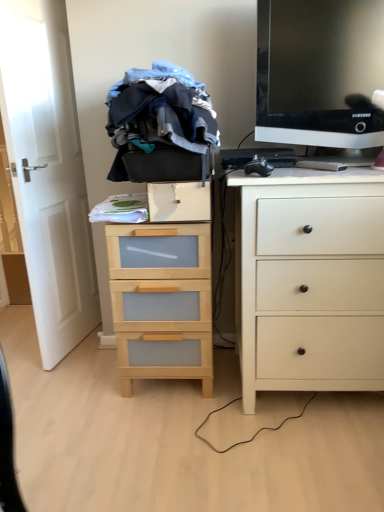
The height and width of the screenshot is (512, 384). What are the coordinates of `wooden drawer at center` in the screenshot? It's located at (179, 202).

Measure the distance between blue cotton clothes at center and camera.

blue cotton clothes at center and camera are 4.44 feet apart from each other.

Where is `blue cotton clothes at center`? The height and width of the screenshot is (512, 384). blue cotton clothes at center is located at coordinates (160, 115).

Where is `black plastic keyboard at center`? black plastic keyboard at center is located at coordinates (258, 157).

Is the depth of black glossy monitor at upper right greater than that of wooden drawer at center?

No, black glossy monitor at upper right is closer to the camera.

Considering the positions of objects black glossy monitor at upper right and wooden drawer at center in the image provided, who is more to the right, black glossy monitor at upper right or wooden drawer at center?

black glossy monitor at upper right.

Is black glossy monitor at upper right oriented away from wooden drawer at center?

No.

How much distance is there between black glossy monitor at upper right and wooden drawer at center?

black glossy monitor at upper right and wooden drawer at center are 22.32 inches apart from each other.

Identify the location of the chest of drawers that is the 2nd object directly below the black plastic keyboard at center (from a real-world perspective). The width and height of the screenshot is (384, 512). (163, 290).

Is wooden chest of drawers at center, the 1th chest of drawers from the left, surrounded by black plastic keyboard at center?

Actually, wooden chest of drawers at center, the 1th chest of drawers from the left, is outside black plastic keyboard at center.

Is black plastic keyboard at center oriented towards wooden chest of drawers at center, the 1th chest of drawers from the left?

No, black plastic keyboard at center does not turn towards wooden chest of drawers at center, the 1th chest of drawers from the left.

Would you consider black plastic keyboard at center to be distant from wooden chest of drawers at center, marked as the second chest of drawers in a right-to-left arrangement?

No, black plastic keyboard at center is not far away from wooden chest of drawers at center, marked as the second chest of drawers in a right-to-left arrangement.

From the image's perspective, relative to white matte chest of drawers at right, the 1th chest of drawers viewed from the right, is black glossy monitor at upper right above or below?

Based on their image positions, black glossy monitor at upper right is located above white matte chest of drawers at right, the 1th chest of drawers viewed from the right.

Does black glossy monitor at upper right turn towards white matte chest of drawers at right, the 1th chest of drawers viewed from the right?

No, black glossy monitor at upper right is not aimed at white matte chest of drawers at right, the 1th chest of drawers viewed from the right.

How many degrees apart are the facing directions of black glossy monitor at upper right and white matte chest of drawers at right, the 1th chest of drawers viewed from the right?

The angle between the facing direction of black glossy monitor at upper right and the facing direction of white matte chest of drawers at right, the 1th chest of drawers viewed from the right, is 1.1 degrees.

Considering the relative positions of black glossy monitor at upper right and white matte chest of drawers at right, the 1th chest of drawers viewed from the right, in the image provided, is black glossy monitor at upper right in front of white matte chest of drawers at right, the 1th chest of drawers viewed from the right,?

No, it is behind white matte chest of drawers at right, the 1th chest of drawers viewed from the right.

Find the location of a particular element. drawer above the white matte chest of drawers at right, which is counted as the 2th chest of drawers, starting from the left (from a real-world perspective) is located at coordinates (179, 202).

Who is shorter, white matte chest of drawers at right, the 1th chest of drawers viewed from the right, or wooden drawer at center?

With less height is wooden drawer at center.

From a real-world perspective, between white matte chest of drawers at right, which is counted as the 2th chest of drawers, starting from the left, and wooden drawer at center, who is vertically higher?

From a 3D spatial view, wooden drawer at center is above.

Is white matte chest of drawers at right, which is counted as the 2th chest of drawers, starting from the left, looking in the opposite direction of wooden drawer at center?

white matte chest of drawers at right, which is counted as the 2th chest of drawers, starting from the left, does not have its back to wooden drawer at center.

Is black glossy monitor at upper right behind wooden chest of drawers at center, marked as the second chest of drawers in a right-to-left arrangement?

No, it is not.

Considering the sizes of objects black glossy monitor at upper right and wooden chest of drawers at center, the 1th chest of drawers from the left, in the image provided, who is wider, black glossy monitor at upper right or wooden chest of drawers at center, the 1th chest of drawers from the left,?

wooden chest of drawers at center, the 1th chest of drawers from the left.

I want to click on television that is on the right side of wooden chest of drawers at center, marked as the second chest of drawers in a right-to-left arrangement, so click(319, 72).

Considering the relative sizes of black glossy monitor at upper right and wooden chest of drawers at center, marked as the second chest of drawers in a right-to-left arrangement, in the image provided, is black glossy monitor at upper right bigger than wooden chest of drawers at center, marked as the second chest of drawers in a right-to-left arrangement,?

Actually, black glossy monitor at upper right might be smaller than wooden chest of drawers at center, marked as the second chest of drawers in a right-to-left arrangement.

Between black plastic keyboard at center and black plastic computer mouse at upper right, which one has more height?

Standing taller between the two is black plastic keyboard at center.

From a real-world perspective, which object rests below the other?

black plastic computer mouse at upper right.

From the picture: From the image's perspective, which one is positioned higher, black plastic keyboard at center or black plastic computer mouse at upper right?

black plastic keyboard at center.

Considering the sizes of black plastic keyboard at center and black plastic computer mouse at upper right in the image, is black plastic keyboard at center bigger or smaller than black plastic computer mouse at upper right?

black plastic keyboard at center is bigger than black plastic computer mouse at upper right.

Considering the sizes of white matte chest of drawers at right, the 1th chest of drawers viewed from the right, and black plastic keyboard at center in the image, is white matte chest of drawers at right, the 1th chest of drawers viewed from the right, bigger or smaller than black plastic keyboard at center?

white matte chest of drawers at right, the 1th chest of drawers viewed from the right, is bigger than black plastic keyboard at center.

Which object is positioned more to the left, white matte chest of drawers at right, which is counted as the 2th chest of drawers, starting from the left, or black plastic keyboard at center?

From the viewer's perspective, black plastic keyboard at center appears more on the left side.

Does white matte chest of drawers at right, which is counted as the 2th chest of drawers, starting from the left, lie behind black plastic keyboard at center?

No, it is not.

Is black plastic keyboard at center at the back of white matte chest of drawers at right, which is counted as the 2th chest of drawers, starting from the left?

No.

Locate an element on the screen. television above the wooden drawer at center (from the image's perspective) is located at coordinates (319, 72).

Find the location of `the 1st chest of drawers in front of the black plastic keyboard at center, starting your count from the anchor`. the 1st chest of drawers in front of the black plastic keyboard at center, starting your count from the anchor is located at coordinates tap(163, 290).

Based on their spatial positions, is white matte chest of drawers at right, the 1th chest of drawers viewed from the right, or wooden drawer at center closer to blue cotton clothes at center?

wooden drawer at center is closer to blue cotton clothes at center.

Which object lies further to the anchor point wooden drawer at center, black plastic computer mouse at upper right or blue cotton clothes at center?

Among the two, black plastic computer mouse at upper right is located further to wooden drawer at center.

When comparing their distances from black glossy monitor at upper right, does wooden drawer at center or wooden chest of drawers at center, the 1th chest of drawers from the left, seem further?

The object further to black glossy monitor at upper right is wooden chest of drawers at center, the 1th chest of drawers from the left.

Looking at the image, which one is located closer to black glossy monitor at upper right, blue cotton clothes at center or black plastic keyboard at center?

black plastic keyboard at center.

Looking at this image, when comparing their distances from black plastic keyboard at center, does white matte chest of drawers at right, the 1th chest of drawers viewed from the right, or wooden drawer at center seem closer?

wooden drawer at center is positioned closer to the anchor black plastic keyboard at center.

When comparing their distances from black plastic keyboard at center, does black plastic computer mouse at upper right or black glossy monitor at upper right seem further?

Based on the image, black glossy monitor at upper right appears to be further to black plastic keyboard at center.

Looking at the image, which one is located further to black glossy monitor at upper right, blue cotton clothes at center or black plastic computer mouse at upper right?

The object further to black glossy monitor at upper right is blue cotton clothes at center.

Which object lies further to the anchor point black plastic keyboard at center, black glossy monitor at upper right or wooden chest of drawers at center, the 1th chest of drawers from the left?

wooden chest of drawers at center, the 1th chest of drawers from the left.

At what (x,y) coordinates should I click in order to perform the action: click on computer mouse between black glossy monitor at upper right and white matte chest of drawers at right, the 1th chest of drawers viewed from the right, in the up-down direction. Please return your answer as a coordinate pair (x, y). This screenshot has height=512, width=384. Looking at the image, I should click on (258, 167).

At what (x,y) coordinates should I click in order to perform the action: click on computer mouse between wooden drawer at center and white matte chest of drawers at right, the 1th chest of drawers viewed from the right, in the horizontal direction. Please return your answer as a coordinate pair (x, y). Looking at the image, I should click on (258, 167).

The height and width of the screenshot is (512, 384). What are the coordinates of `chest of drawers between blue cotton clothes at center and white matte chest of drawers at right, which is counted as the 2th chest of drawers, starting from the left` in the screenshot? It's located at (163, 290).

At what (x,y) coordinates should I click in order to perform the action: click on computer mouse located between blue cotton clothes at center and white matte chest of drawers at right, the 1th chest of drawers viewed from the right, in the left-right direction. Please return your answer as a coordinate pair (x, y). Image resolution: width=384 pixels, height=512 pixels. Looking at the image, I should click on (258, 167).